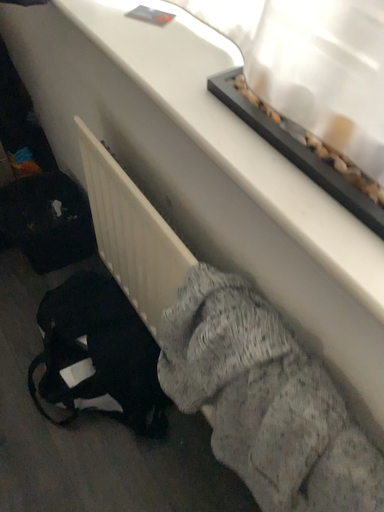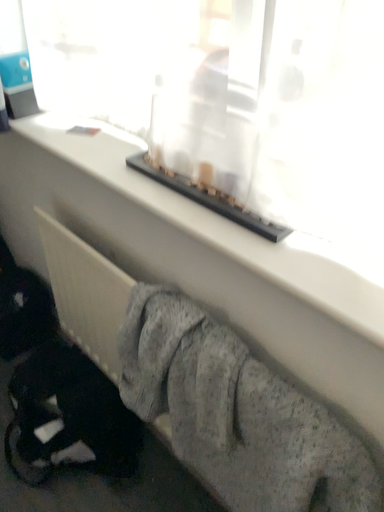
Question: How did the camera likely rotate when shooting the video?

Choices:
 (A) rotated downward
 (B) rotated upward

Answer: (B)